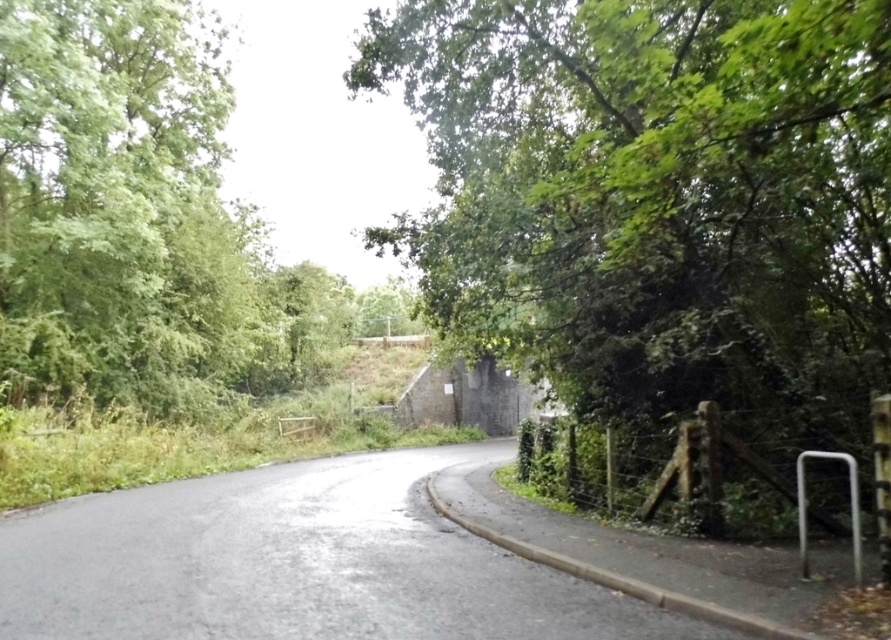
Question: Can you confirm if green leafy tree at center is bigger than green leafy tree at left?

Choices:
 (A) no
 (B) yes

Answer: (A)

Question: Does green leafy tree at center come in front of green leafy tree at left?

Choices:
 (A) no
 (B) yes

Answer: (B)

Question: Which object appears farthest from the camera in this image?

Choices:
 (A) green leafy tree at left
 (B) green leafy tree at center

Answer: (A)

Question: Which of the following is the farthest from the observer?

Choices:
 (A) green leafy tree at left
 (B) green leafy tree at center

Answer: (A)

Question: Which object is closer to the camera taking this photo?

Choices:
 (A) green leafy tree at center
 (B) green leafy tree at left

Answer: (A)

Question: Considering the relative positions of green leafy tree at center and green leafy tree at left in the image provided, where is green leafy tree at center located with respect to green leafy tree at left?

Choices:
 (A) right
 (B) left

Answer: (A)